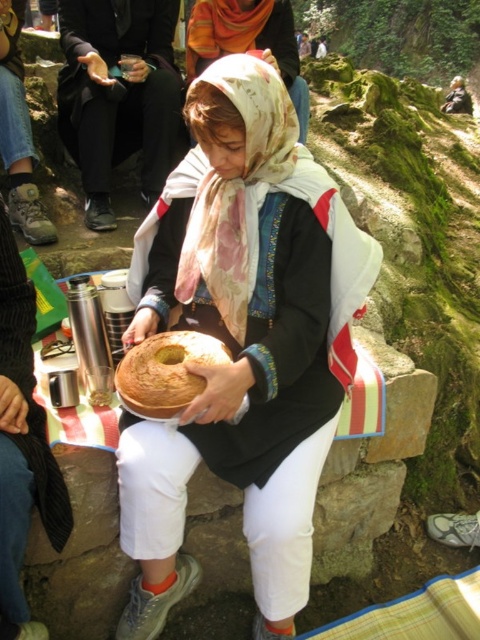
Question: Does white floral headscarf at center lie behind brown matte bread at center?

Choices:
 (A) no
 (B) yes

Answer: (B)

Question: From the image, what is the correct spatial relationship of white floral headscarf at center in relation to brown matte bread at center?

Choices:
 (A) left
 (B) right

Answer: (B)

Question: Is matte brown cake at center positioned at the back of brown matte bread at center?

Choices:
 (A) no
 (B) yes

Answer: (A)

Question: Which point appears farthest from the camera in this image?

Choices:
 (A) (201, 54)
 (B) (206, 93)
 (C) (171, 392)

Answer: (A)

Question: Which of the following is the farthest from the observer?

Choices:
 (A) (250, 16)
 (B) (269, 497)

Answer: (A)

Question: Which object is the closest to the white floral headscarf at center?

Choices:
 (A) brown matte bread at center
 (B) matte brown cake at center

Answer: (B)